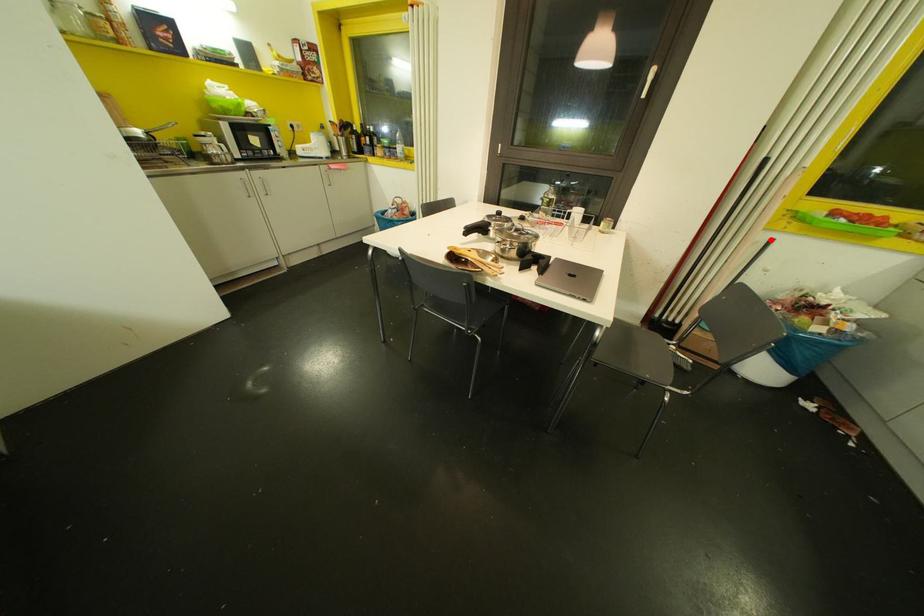
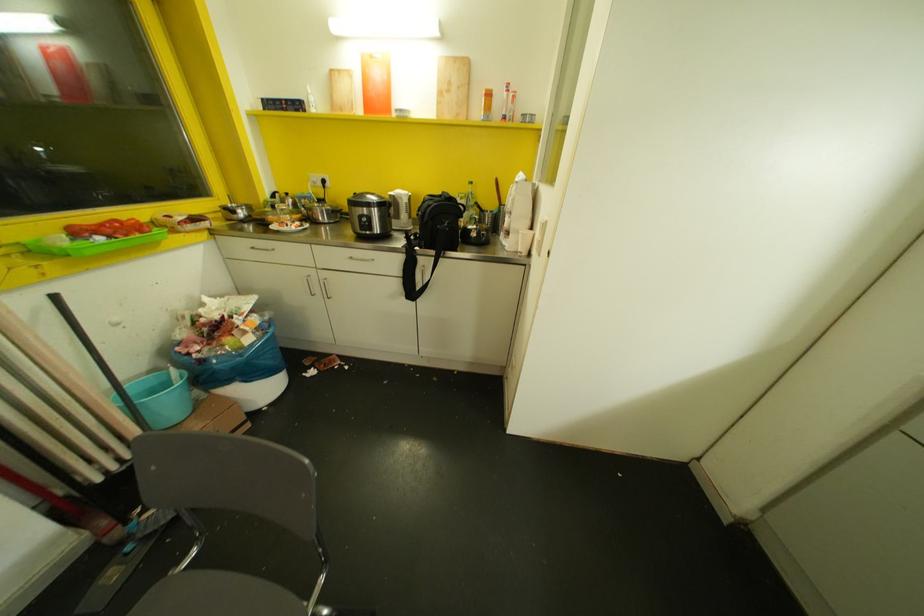
In the second image, find the point that corresponds to the highlighted location in the first image.

(55, 296)